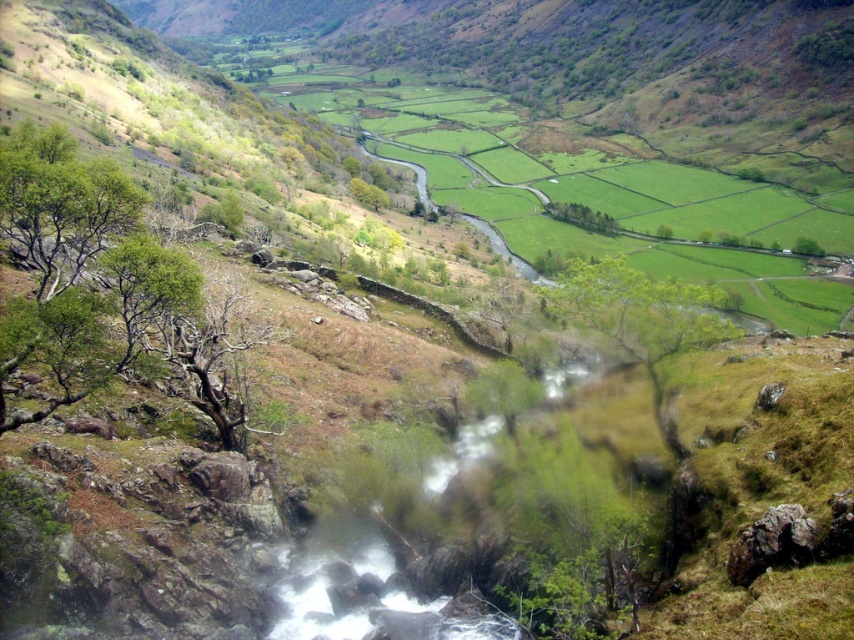
Question: Which is nearer to the green leafy tree at center?

Choices:
 (A) green leafy tree at left
 (B) green leafy tree at center-right

Answer: (A)

Question: Considering the relative positions of green leafy tree at left and green leafy tree at center-right in the image provided, where is green leafy tree at left located with respect to green leafy tree at center-right?

Choices:
 (A) right
 (B) left

Answer: (B)

Question: Among these objects, which one is nearest to the camera?

Choices:
 (A) green leafy tree at center
 (B) green leafy tree at left
 (C) green leafy tree at center-right

Answer: (B)

Question: Is green leafy tree at left wider than green leafy tree at center?

Choices:
 (A) yes
 (B) no

Answer: (A)

Question: Considering the relative positions of green leafy tree at left and green leafy tree at center in the image provided, where is green leafy tree at left located with respect to green leafy tree at center?

Choices:
 (A) above
 (B) below

Answer: (A)

Question: Considering the real-world distances, which object is closest to the green leafy tree at left?

Choices:
 (A) green leafy tree at center-right
 (B) green leafy tree at center

Answer: (B)